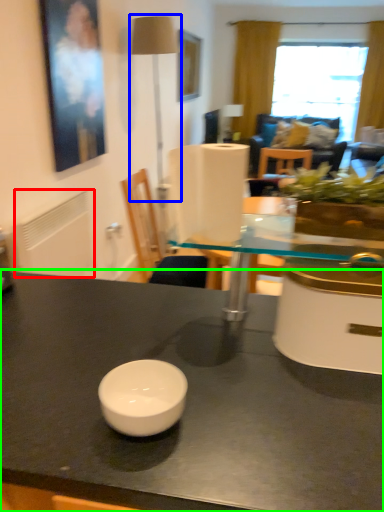
Question: Estimate the real-world distances between objects in this image. Which object is closer to radiator (highlighted by a red box), table lamp (highlighted by a blue box) or table (highlighted by a green box)?

Choices:
 (A) table lamp
 (B) table

Answer: (B)